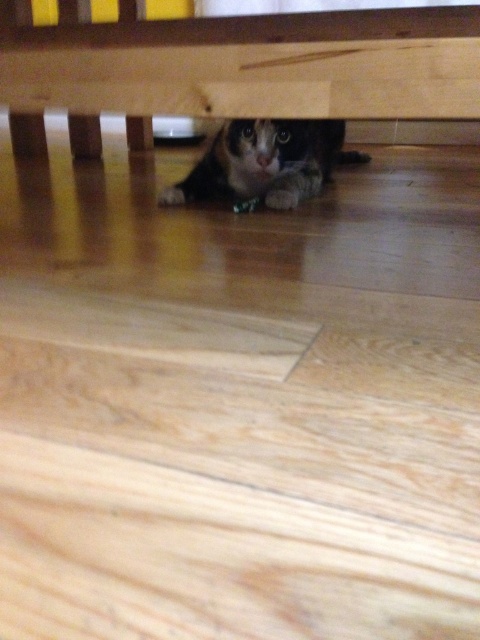
Is point (24, 106) less distant than point (243, 173)?

Yes, point (24, 106) is in front of point (243, 173).

This screenshot has width=480, height=640. What do you see at coordinates (244, 68) in the screenshot?
I see `wooden table at lower center` at bounding box center [244, 68].

Between point (105, 52) and point (168, 198), which one is positioned behind?

The point (168, 198) is behind.

You are a GUI agent. You are given a task and a screenshot of the screen. Output one action in this format:
    pyautogui.click(x=<x>, y=<y>)
    Task: Click on the wooden table at lower center
    This screenshot has height=640, width=480.
    Given the screenshot: What is the action you would take?
    pyautogui.click(x=244, y=68)